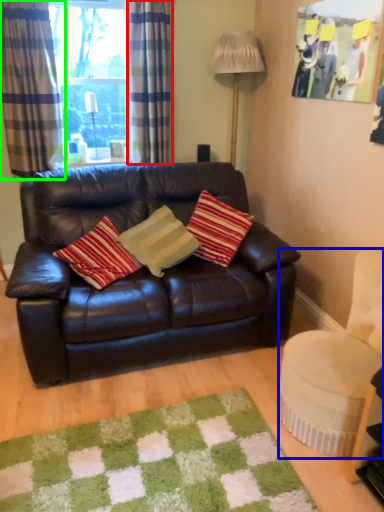
Question: Which object is positioned farthest from curtain (highlighted by a red box)? Select from swivel chair (highlighted by a blue box) and curtain (highlighted by a green box).

Choices:
 (A) swivel chair
 (B) curtain

Answer: (A)